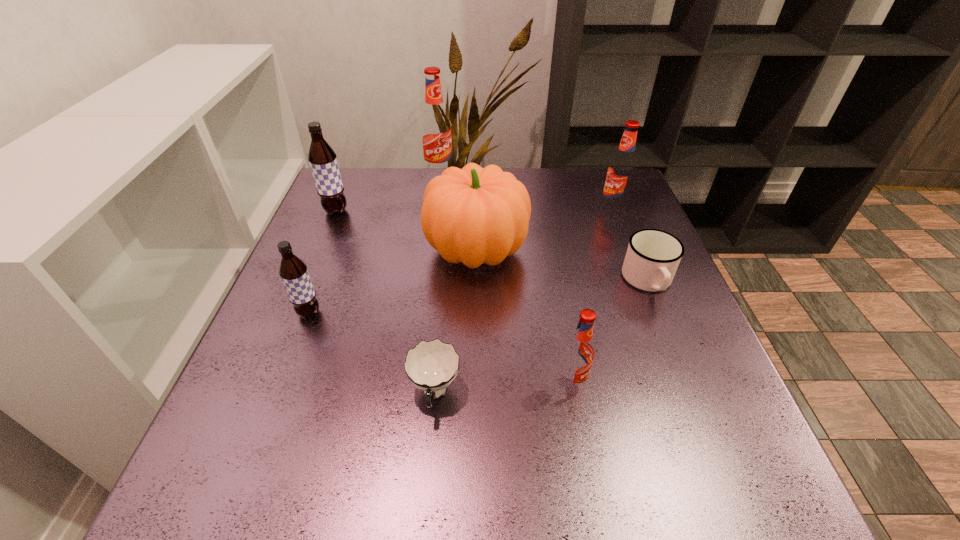
In order to click on the farthest object in this screenshot , I will do `click(435, 124)`.

At what (x,y) coordinates should I click in order to perform the action: click on the farthest red root beer. Please return your answer as a coordinate pair (x, y). Image resolution: width=960 pixels, height=540 pixels. Looking at the image, I should click on (435, 124).

The image size is (960, 540). I want to click on the second biggest red root beer, so click(621, 171).

Where is `the second farthest red root beer`? the second farthest red root beer is located at coordinates (621, 171).

Where is `the bigger brown root beer`? The width and height of the screenshot is (960, 540). the bigger brown root beer is located at coordinates (323, 162).

Find the location of a particular element. The width and height of the screenshot is (960, 540). pumpkin is located at coordinates (474, 215).

Where is `the nearer brown root beer`? the nearer brown root beer is located at coordinates (293, 271).

Locate an element on the screen. The image size is (960, 540). the smaller brown root beer is located at coordinates (293, 271).

The image size is (960, 540). I want to click on the third object from right to left, so click(x=579, y=351).

You are a GUI agent. You are given a task and a screenshot of the screen. Output one action in this format:
    pyautogui.click(x=<x>, y=<y>)
    Task: Click on the second red root beer from right to left
    
    Given the screenshot: What is the action you would take?
    pyautogui.click(x=579, y=351)